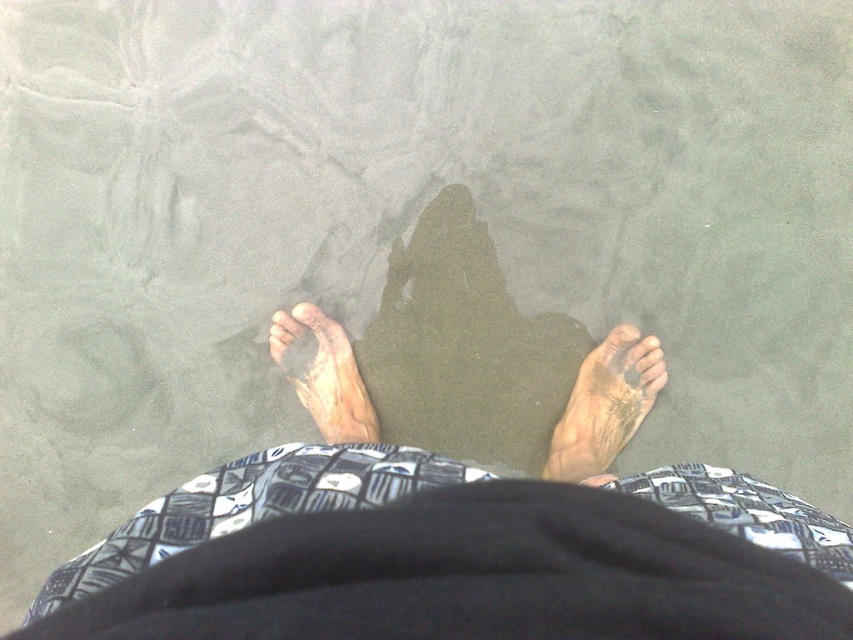
You are a photographer capturing the scene from above. You notice the brown skin at center and the black fabric at center. Which object is located directly beneath the other?

The brown skin at center is positioned over the black fabric at center, so the black fabric at center is directly beneath the brown skin at center.

You are a photographer trying to capture the texture of the sand between the dusty skin foot at lower right and the brown matte toe at lower right. Which object is closer to the sand?

The dusty skin foot at lower right is located below the brown matte toe at lower right, so it is closer to the sand.

You are a lifeguard on duty at the beach. You notice a person standing on the sand. Where exactly is the brown skin at center located in relation to the person?

The brown skin at center is located at point coordinates of 0.872 on the x axis and 0.530 on the y axis.